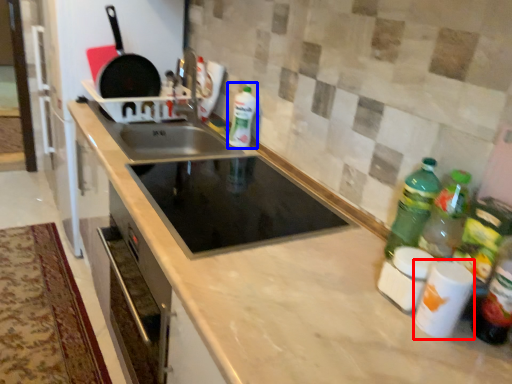
Question: Which object is closer to the camera taking this photo, appliance (highlighted by a red box) or bottle (highlighted by a blue box)?

Choices:
 (A) appliance
 (B) bottle

Answer: (A)